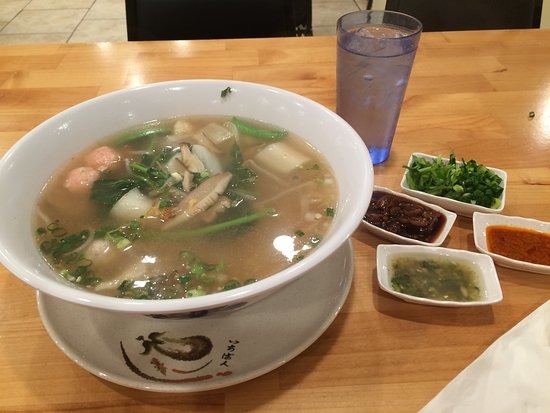
Image resolution: width=550 pixels, height=413 pixels. Identify the location of tile flooring. (88, 24).